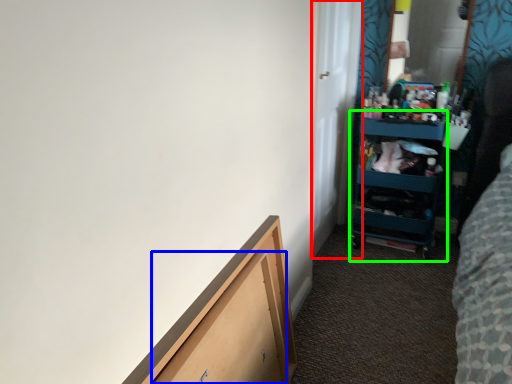
Question: Considering the real-world distances, which object is closest to door (highlighted by a red box)? drawer (highlighted by a blue box) or cabinet (highlighted by a green box).

Choices:
 (A) drawer
 (B) cabinet

Answer: (B)